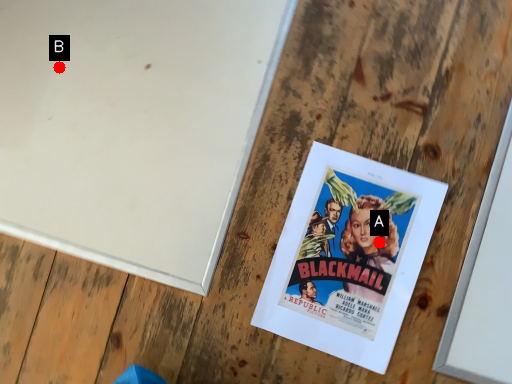
Question: Two points are circled on the image, labeled by A and B beside each circle. Which point is further to the camera?

Choices:
 (A) A is further
 (B) B is further

Answer: (B)